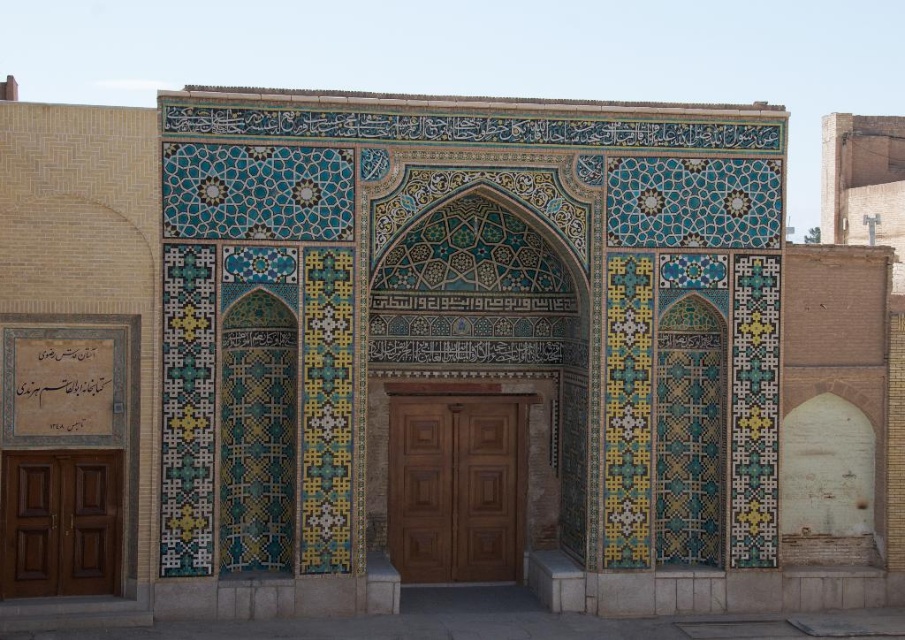
Question: Is brown wooden door at center in front of brown wooden door at left?

Choices:
 (A) no
 (B) yes

Answer: (A)

Question: Which point is farther from the camera taking this photo?

Choices:
 (A) (7, 493)
 (B) (424, 531)

Answer: (B)

Question: Which point is farther to the camera?

Choices:
 (A) (389, 508)
 (B) (5, 572)

Answer: (A)

Question: Can you confirm if brown wooden door at center is thinner than brown wooden door at left?

Choices:
 (A) no
 (B) yes

Answer: (B)

Question: Is brown wooden door at center bigger than brown wooden door at left?

Choices:
 (A) no
 (B) yes

Answer: (A)